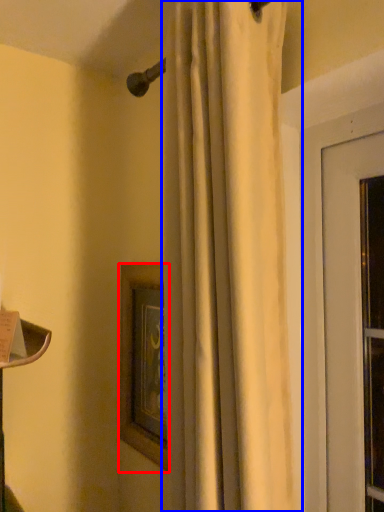
Question: Which object is further to the camera taking this photo, picture frame (highlighted by a red box) or curtain (highlighted by a blue box)?

Choices:
 (A) picture frame
 (B) curtain

Answer: (A)